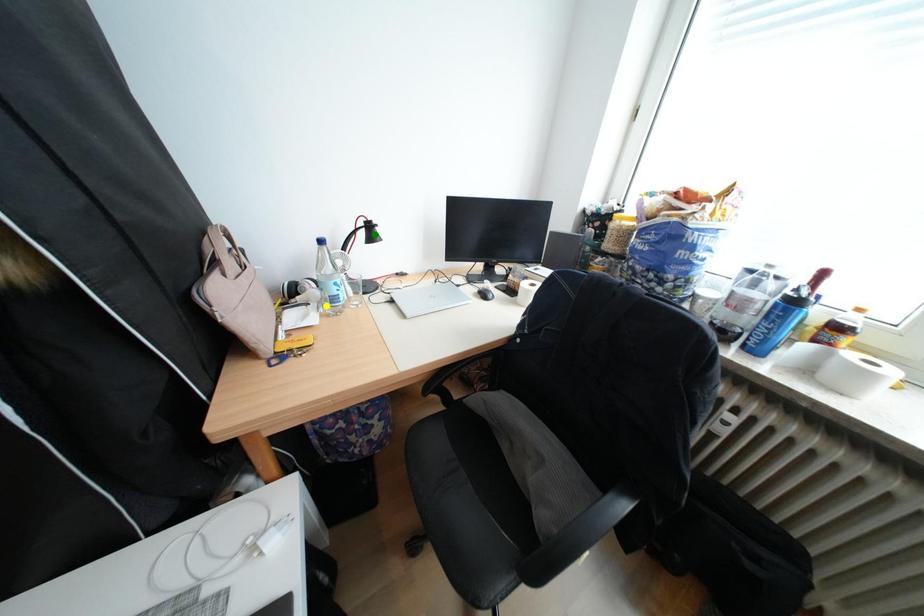
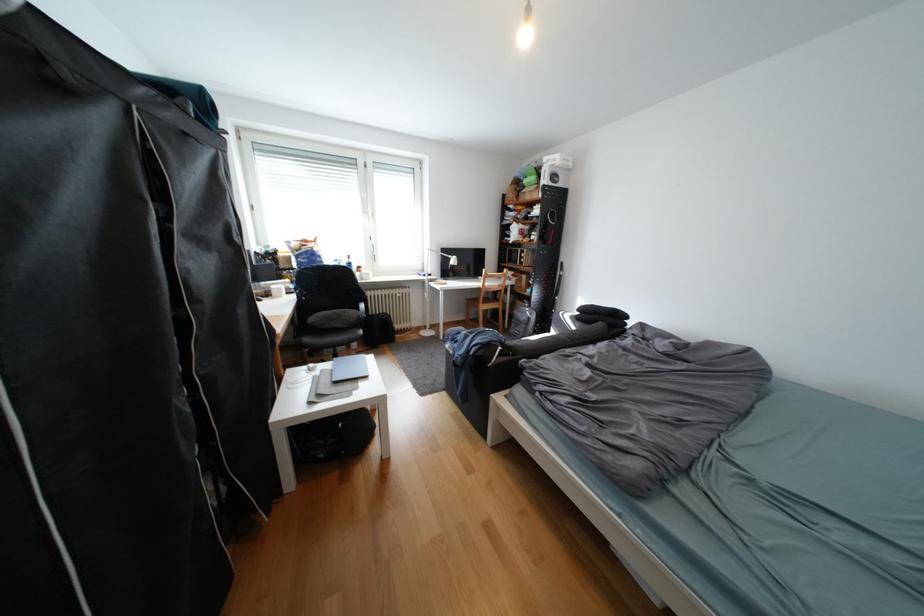
I am providing you with two images of the same scene from different viewpoints. Three points are marked in image1. Which point corresponds to a part or object that is occluded in image2?In image1, three points are marked. Which of them correspond to a part or object that is occluded in image2?Among the three points shown in image1, which one corresponds to a part or object that is no longer visible due to occlusion in image2?

green point, blue point, yellow point cannot be seen in image2.